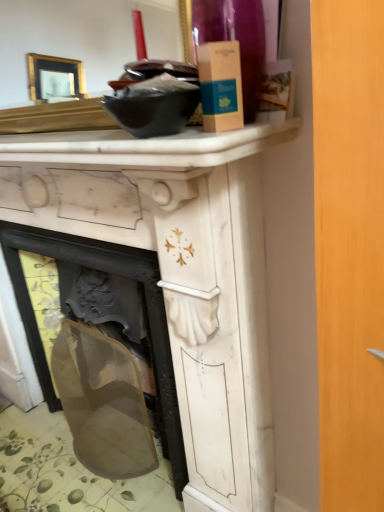
Question: From a real-world perspective, is white marble counter top at upper center positioned above or below transparent plastic screen at lower left?

Choices:
 (A) above
 (B) below

Answer: (A)

Question: Based on their sizes in the image, would you say white marble counter top at upper center is bigger or smaller than transparent plastic screen at lower left?

Choices:
 (A) big
 (B) small

Answer: (B)

Question: Estimate the real-world distances between objects in this image. Which object is closer to the white marble counter top at upper center?

Choices:
 (A) white marble fireplace at center
 (B) transparent plastic screen at lower left

Answer: (A)

Question: Which of these objects is positioned farthest from the transparent plastic screen at lower left?

Choices:
 (A) white marble counter top at upper center
 (B) white marble fireplace at center

Answer: (A)